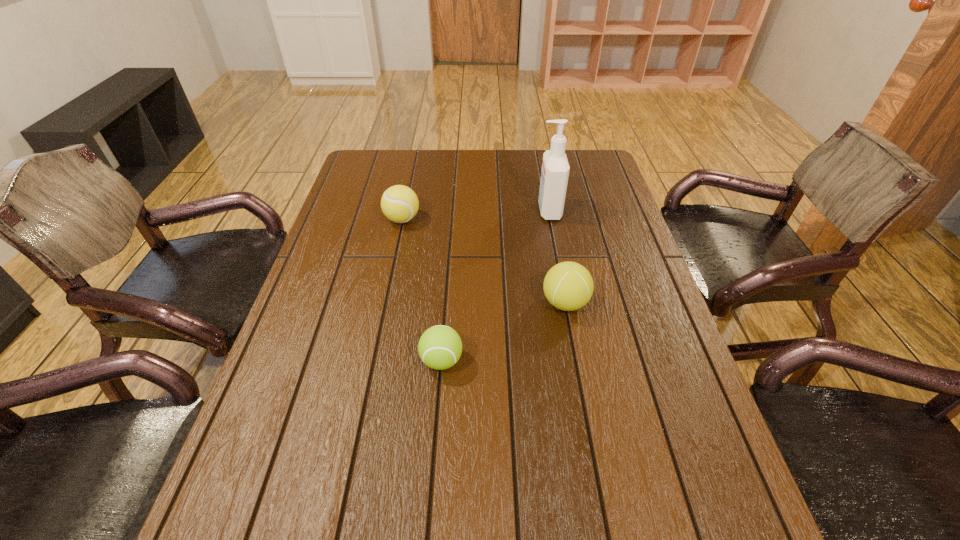
At what (x,y) coordinates should I click in order to perform the action: click on tennis ball that can be found as the third closest to the tallest object. Please return your answer as a coordinate pair (x, y). Looking at the image, I should click on (440, 347).

This screenshot has height=540, width=960. I want to click on vacant region that satisfies the following two spatial constraints: 1. on the back side of the second nearest object; 2. on the right side of the shortest tennis ball, so pos(445,303).

The height and width of the screenshot is (540, 960). I want to click on vacant area in the image that satisfies the following two spatial constraints: 1. on the front label of the tallest object; 2. on the front side of the shortest object, so click(x=577, y=361).